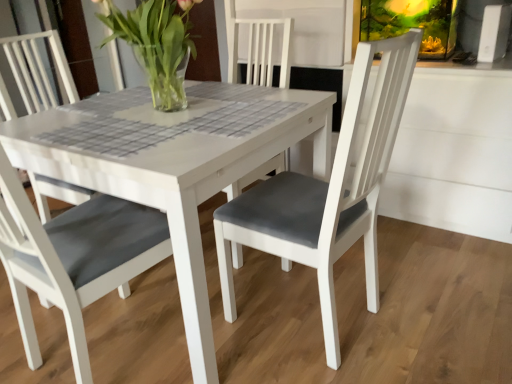
The image size is (512, 384). I want to click on clear glass vase at center, so click(157, 45).

What do you see at coordinates (157, 45) in the screenshot? I see `clear glass vase at center` at bounding box center [157, 45].

This screenshot has width=512, height=384. What do you see at coordinates (74, 257) in the screenshot?
I see `matte gray cushion at center` at bounding box center [74, 257].

Identify the location of matte gray cushion at center. The width and height of the screenshot is (512, 384). pyautogui.click(x=74, y=257).

The image size is (512, 384). I want to click on clear glass vase at center, so click(157, 45).

Considering the positions of objects clear glass vase at center and matte gray cushion at center in the image provided, who is more to the right, clear glass vase at center or matte gray cushion at center?

matte gray cushion at center.

Considering the relative positions of clear glass vase at center and matte gray cushion at center in the image provided, is clear glass vase at center behind matte gray cushion at center?

That is True.

Is point (119, 14) farther from camera compared to point (98, 224)?

Yes, point (119, 14) is behind point (98, 224).

From the image's perspective, is clear glass vase at center above matte gray cushion at center?

Yes, from the image's perspective, clear glass vase at center is on top of matte gray cushion at center.

From a real-world perspective, which object stands above the other?

clear glass vase at center, from a real-world perspective.

Between clear glass vase at center and matte gray cushion at center, which one has smaller width?

Thinner between the two is clear glass vase at center.

In terms of height, does clear glass vase at center look taller or shorter compared to matte gray cushion at center?

Clearly, clear glass vase at center is shorter compared to matte gray cushion at center.

Considering the relative sizes of clear glass vase at center and matte gray cushion at center in the image provided, is clear glass vase at center smaller than matte gray cushion at center?

Yes, clear glass vase at center is smaller than matte gray cushion at center.

Would you say clear glass vase at center contains matte gray cushion at center?

No, matte gray cushion at center is not inside clear glass vase at center.

Is the surface of clear glass vase at center in direct contact with matte gray cushion at center?

There is a gap between clear glass vase at center and matte gray cushion at center.

Is clear glass vase at center looking in the opposite direction of matte gray cushion at center?

No, clear glass vase at center is not facing away from matte gray cushion at center.

Can you tell me how much clear glass vase at center and matte gray cushion at center differ in facing direction?

The facing directions of clear glass vase at center and matte gray cushion at center are 0.000267 degrees apart.

Locate an element on the screen. houseplant behind the matte gray cushion at center is located at coordinates (157, 45).

Is matte gray cushion at center at the left side of clear glass vase at center?

No, matte gray cushion at center is not to the left of clear glass vase at center.

Which object is more forward, matte gray cushion at center or clear glass vase at center?

matte gray cushion at center is closer to the camera.

Between point (102, 289) and point (159, 69), which one is positioned behind?

Positioned behind is point (159, 69).

From the image's perspective, which one is positioned lower, matte gray cushion at center or clear glass vase at center?

matte gray cushion at center.

From the picture: From a real-world perspective, is matte gray cushion at center physically above clear glass vase at center?

No, from a real-world perspective, matte gray cushion at center is not over clear glass vase at center

Is matte gray cushion at center wider or thinner than clear glass vase at center?

Clearly, matte gray cushion at center has more width compared to clear glass vase at center.

Is matte gray cushion at center shorter than clear glass vase at center?

No, matte gray cushion at center is not shorter than clear glass vase at center.

Considering the relative sizes of matte gray cushion at center and clear glass vase at center in the image provided, is matte gray cushion at center smaller than clear glass vase at center?

Actually, matte gray cushion at center might be larger than clear glass vase at center.

Could clear glass vase at center be considered to be inside matte gray cushion at center?

No.

Is matte gray cushion at center far from clear glass vase at center?

That's not correct — matte gray cushion at center is a little close to clear glass vase at center.

Is matte gray cushion at center facing towards clear glass vase at center?

No, matte gray cushion at center is not turned towards clear glass vase at center.

What's the angular difference between matte gray cushion at center and clear glass vase at center's facing directions?

0.000267 degrees.

At what (x,y) coordinates should I click in order to perform the action: click on chair below the clear glass vase at center (from the image's perspective). Please return your answer as a coordinate pair (x, y). Image resolution: width=512 pixels, height=384 pixels. Looking at the image, I should click on (x=74, y=257).

The width and height of the screenshot is (512, 384). In the image, there is a clear glass vase at center. In order to click on chair below it (from the image's perspective) in this screenshot , I will do `click(74, 257)`.

Where is `chair lying on the right of clear glass vase at center`? chair lying on the right of clear glass vase at center is located at coordinates (74, 257).